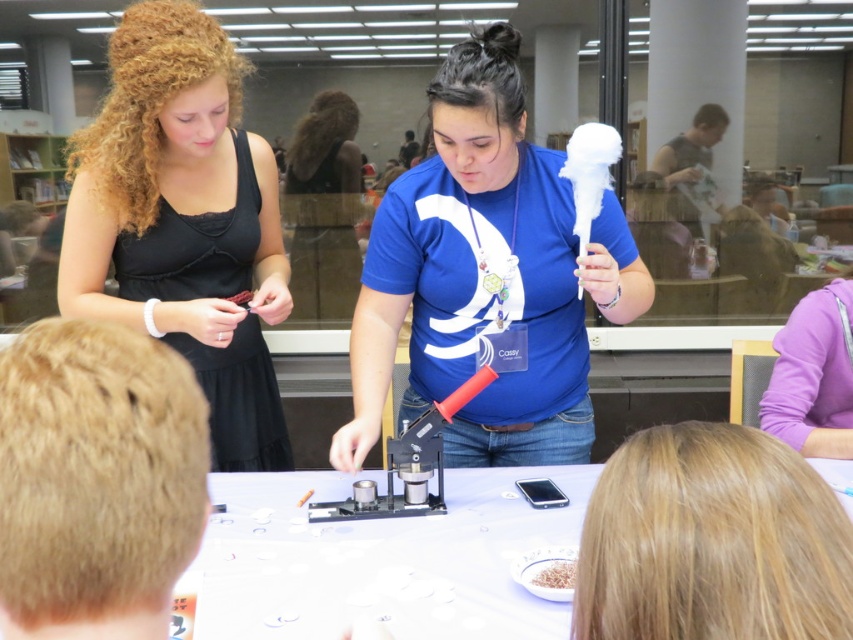
Question: From the image, what is the correct spatial relationship of black satin dress at upper left in relation to brown crumbly food at center?

Choices:
 (A) left
 (B) right

Answer: (A)

Question: Which point appears farthest from the camera in this image?

Choices:
 (A) (260, 632)
 (B) (215, 92)
 (C) (543, 584)
 (D) (520, 129)

Answer: (B)

Question: Is black satin dress at upper left below white paper at center?

Choices:
 (A) no
 (B) yes

Answer: (A)

Question: Can you confirm if black satin dress at upper left is positioned above blonde hair at lower right?

Choices:
 (A) no
 (B) yes

Answer: (B)

Question: Which of the following is the closest to the observer?

Choices:
 (A) (322, 593)
 (B) (65, 253)
 (C) (421, 337)

Answer: (A)

Question: Which of the following is the farthest from the observer?

Choices:
 (A) (206, 193)
 (B) (412, 540)
 (C) (724, 522)
 (D) (570, 586)

Answer: (A)